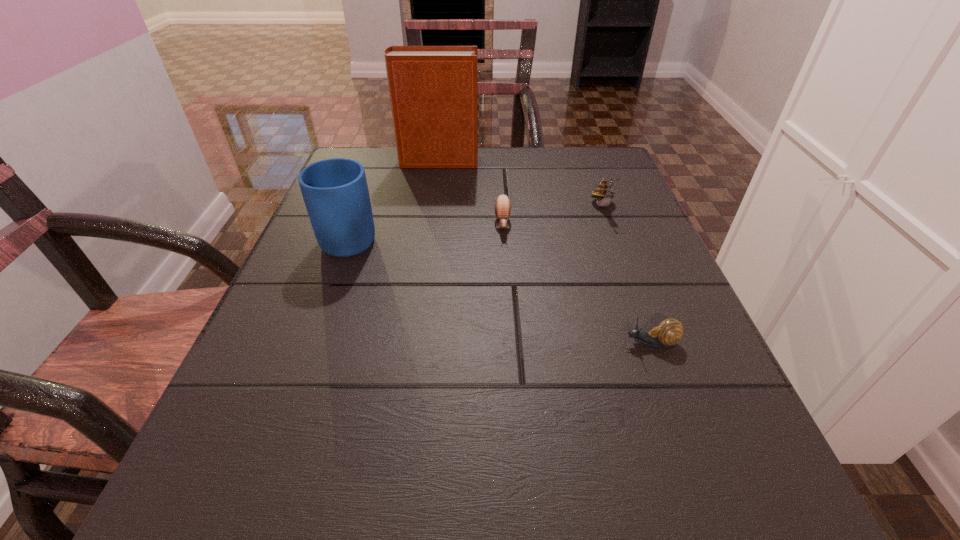
Identify the location of escargot that stands as the third closest to the mug. (669, 332).

Locate which escargot ranks third in proximity to the farthest object. Please provide its 2D coordinates. Your answer should be formatted as a tuple, i.e. [(x, y)], where the tuple contains the x and y coordinates of a point satisfying the conditions above.

[(669, 332)]